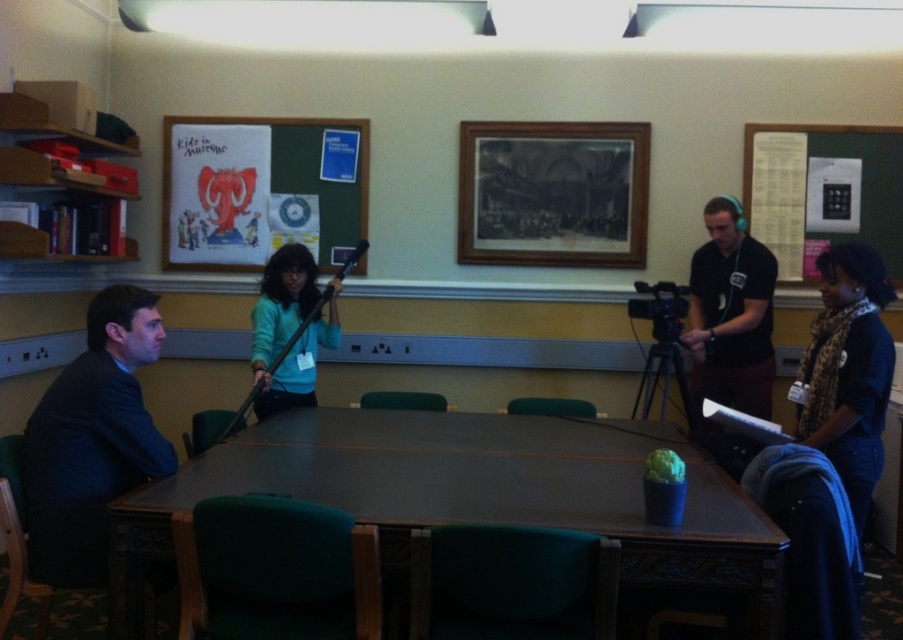
Question: Which point is farther to the camera?

Choices:
 (A) teal matte sweater at center
 (B) white paperboard at upper right
 (C) black matte headphones at upper right

Answer: (B)

Question: Is white paperboard at upper right thinner than teal matte sweater at center?

Choices:
 (A) no
 (B) yes

Answer: (A)

Question: Can you confirm if wooden table at center is thinner than dark blue suit at left?

Choices:
 (A) yes
 (B) no

Answer: (B)

Question: Can you confirm if dark blue suit at left is positioned above leopard print scarf at right?

Choices:
 (A) yes
 (B) no

Answer: (B)

Question: Which point is farther to the camera?

Choices:
 (A) 592,170
 (B) 771,550
 (C) 849,445

Answer: (A)

Question: Based on their relative distances, which object is farther from the matte paper poster at upper center?

Choices:
 (A) white paperboard at upper right
 (B) dark blue suit at left
 (C) wooden table at center

Answer: (A)